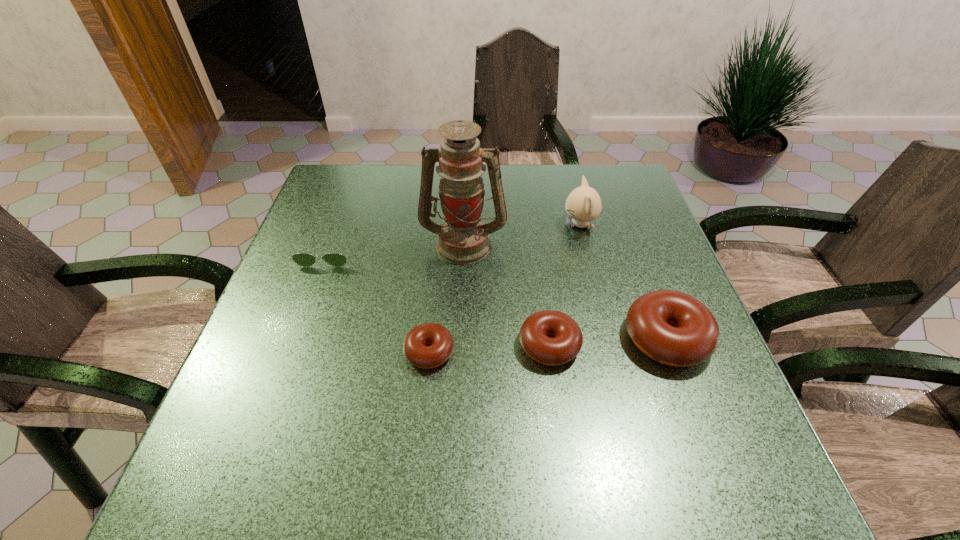
Observe the arrangement of all doughnuts in the image. To keep them evenly spaced, where would you place another doughnut on the left? Please locate a free space. Please provide its 2D coordinates. Your answer should be formatted as a tuple, i.e. [(x, y)], where the tuple contains the x and y coordinates of a point satisfying the conditions above.

[(306, 359)]